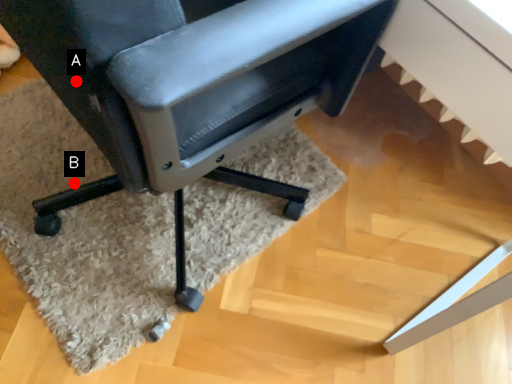
Question: Two points are circled on the image, labeled by A and B beside each circle. Which point appears closest to the camera in this image?

Choices:
 (A) A is closer
 (B) B is closer

Answer: (A)